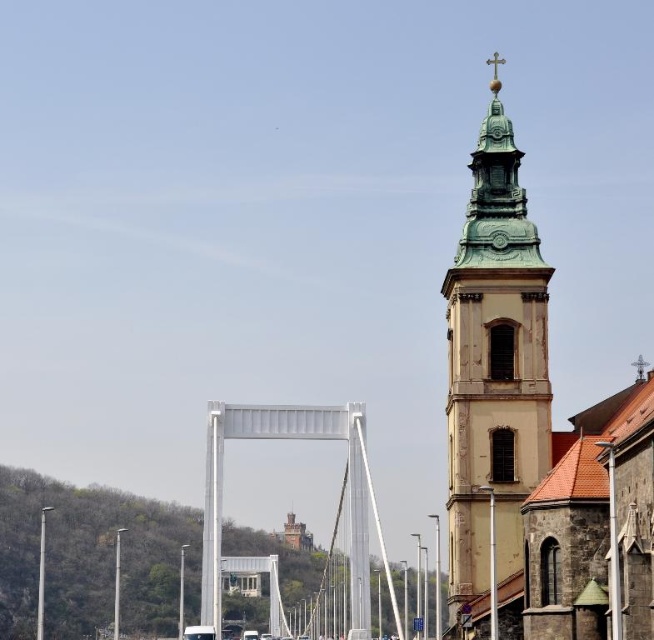
Who is higher up, green copper tower at right or white metallic bridge at center?

Positioned higher is green copper tower at right.

Between green copper tower at right and white metallic bridge at center, which one has less height?

With less height is white metallic bridge at center.

Does point (536, 346) lie in front of point (320, 412)?

Yes, point (536, 346) is closer to viewer.

Image resolution: width=654 pixels, height=640 pixels. I want to click on green copper tower at right, so click(494, 365).